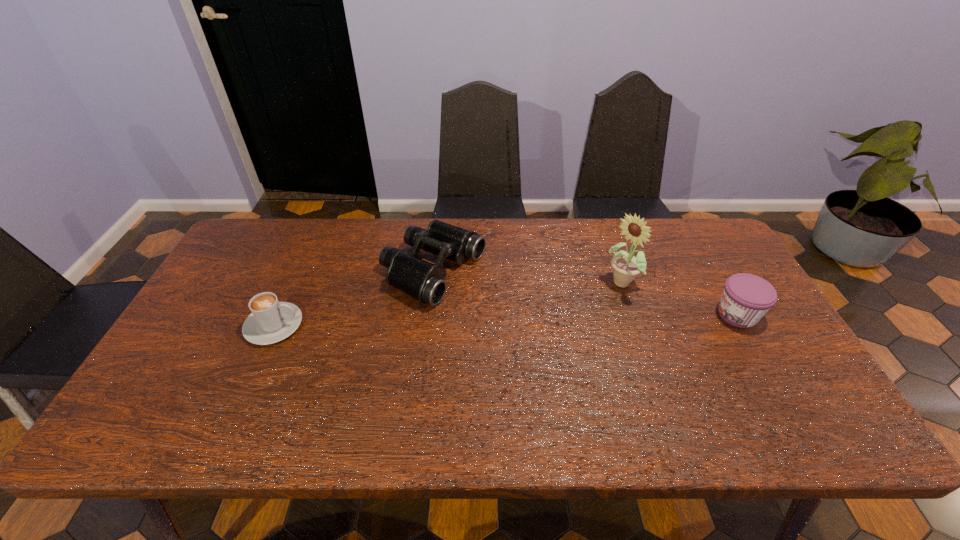
Where is `vacant space situated 0.110m on the front-facing side of the second object from left to right`? The height and width of the screenshot is (540, 960). vacant space situated 0.110m on the front-facing side of the second object from left to right is located at coordinates 512,305.

Where is `free space located on the front-facing side of the second object from left to right`? free space located on the front-facing side of the second object from left to right is located at coordinates (535, 314).

What are the coordinates of `vacant space positioned on the front-facing side of the sunflower` in the screenshot? It's located at (550, 342).

Where is `free region located 0.250m on the front-facing side of the sunflower`? free region located 0.250m on the front-facing side of the sunflower is located at coordinates (553, 340).

Locate an element on the screen. vacant space located on the front-facing side of the sunflower is located at coordinates (515, 369).

What are the coordinates of `object that is at the far edge` in the screenshot? It's located at (425, 282).

Where is `object located at the left edge`? object located at the left edge is located at coordinates (271, 321).

Locate an element on the screen. object located in the right edge section of the desktop is located at coordinates (746, 298).

The image size is (960, 540). I want to click on vacant space at the far edge, so click(x=566, y=244).

Find the location of a particular element. Image resolution: width=960 pixels, height=540 pixels. vacant area at the near edge is located at coordinates (566, 380).